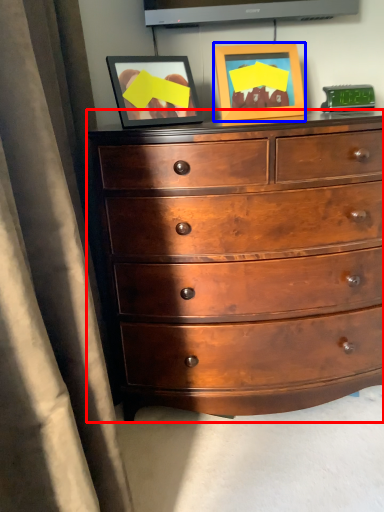
Question: Which object appears farthest to the camera in this image, chest of drawers (highlighted by a red box) or picture frame (highlighted by a blue box)?

Choices:
 (A) chest of drawers
 (B) picture frame

Answer: (B)